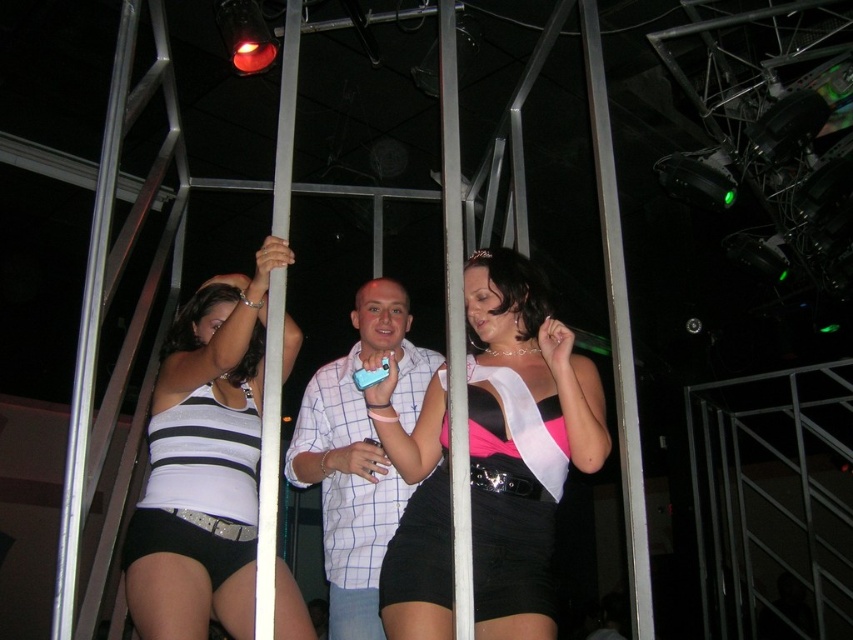
Does white checkered shirt at center have a lesser width compared to black satin shorts at center?

Incorrect, white checkered shirt at center's width is not less than black satin shorts at center's.

Who is more forward, (357,456) or (534,524)?

Point (534,524) is more forward.

The image size is (853, 640). I want to click on white checkered shirt at center, so click(358, 456).

Which is behind, point (585, 468) or point (506, 552)?

Point (506, 552)

Who is positioned more to the left, matte black dress at center or black satin shorts at center?

black satin shorts at center

Who is more distant from viewer, (601, 422) or (486, 577)?

The point (601, 422) is behind.

The width and height of the screenshot is (853, 640). I want to click on matte black dress at center, so click(x=521, y=440).

Between white checkered shirt at center and black satin shorts at lower left, which one is positioned higher?

Positioned higher is white checkered shirt at center.

Which of these two, white checkered shirt at center or black satin shorts at lower left, stands taller?

white checkered shirt at center is taller.

Find the location of a particular element. The height and width of the screenshot is (640, 853). white checkered shirt at center is located at coordinates (358, 456).